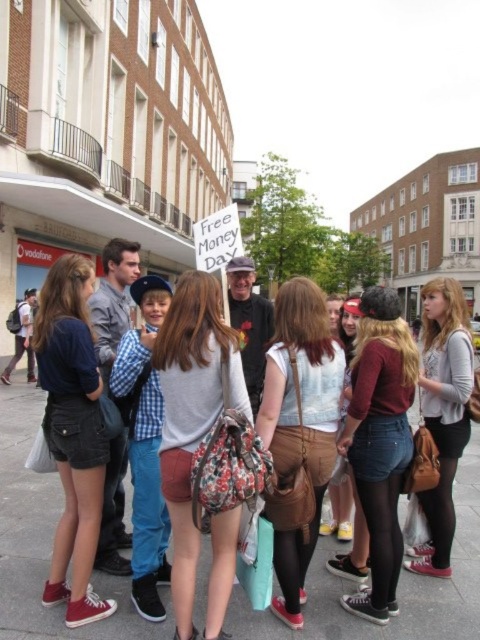
In the scene shown: You are a photographer trying to capture a wide shot of the crowd. You notice the denim shorts at left and the matte gray sweater at center. Which clothing item takes up more horizontal space in the photo?

The matte gray sweater at center takes up more horizontal space in the photo because it has a greater width than the denim shorts at left.

Based on the photo, in the scene described, where is the checkered fabric shirt at center in relation to the matte gray sweater at center?

The checkered fabric shirt at center is to the left of the matte gray sweater at center.

You are a photographer standing at the camera position. You want to take a closeup shot of the man holding the sign but need to ensure the floral fabric backpack at center won not block the view. Is the backpack too close to the camera to be in the frame?

The floral fabric backpack at center is 19.23 meters away from the camera. Since it is positioned at the center and at that distance, it would likely be in the frame and could potentially block the view of the man holding the sign unless adjusted. However, the exact impact depends on the lens used and framing choices.